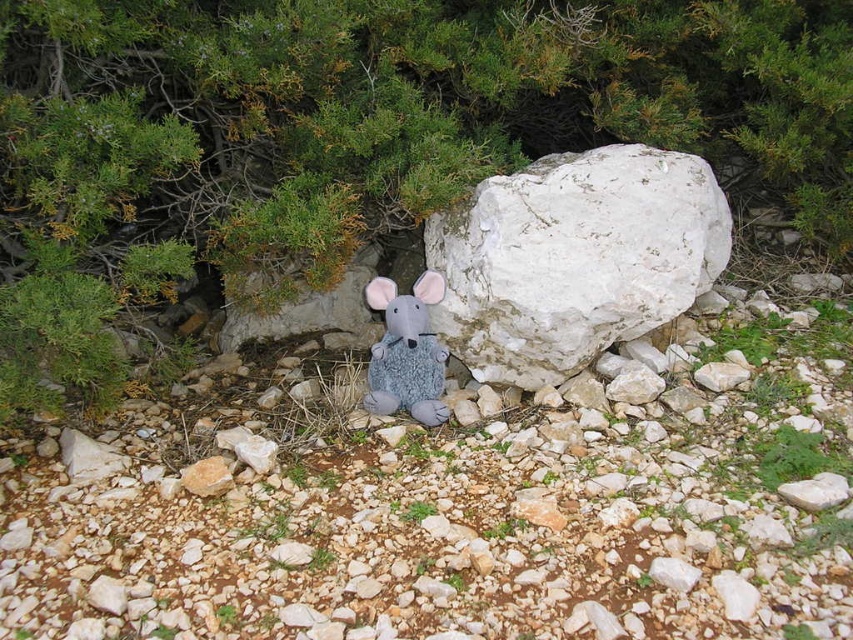
You are standing in the outdoor area and want to place a small flag next to the fuzzy gray plush mouse at center. According to the scene, which direction should you place the flag relative to the mouse to face the green leafy tree at upper center?

The green leafy tree at upper center is to the right of the fuzzy gray plush mouse at center, so you should place the flag to the right of the mouse to face the tree.

You are a bird flying over the scene and want to land on the fuzzy gray plush mouse at center. Before landing, you notice the green leafy tree at upper center. Is the tree blocking your direct path to the mouse?

Yes, the green leafy tree at upper center is in front of the fuzzy gray plush mouse at center, so it would block the direct path to the mouse.